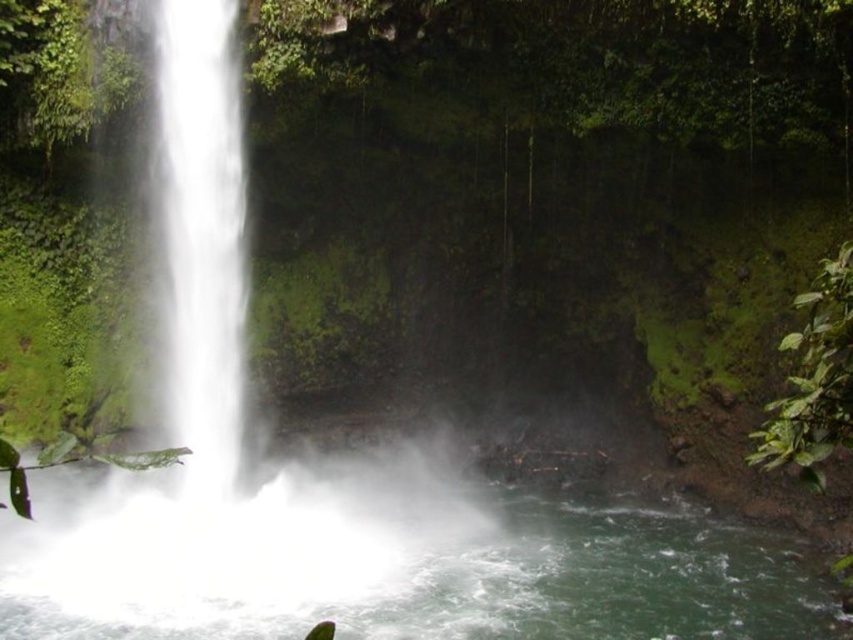
You are standing at the edge of the cliff overlooking the waterfall. You notice two distinct parts of the waterfall in the image. Which part, the white frothy water at center or the white misty waterfall at left, occupies a bigger area?

The white frothy water at center has a larger size compared to the white misty waterfall at left, so it occupies a bigger area.

You are standing at the edge of the cliff overlooking the waterfall. You see the white frothy water at center and the white misty waterfall at left. Which one is positioned more to the right side from your viewpoint?

The white frothy water at center is positioned more to the right side from your viewpoint compared to the white misty waterfall at left.